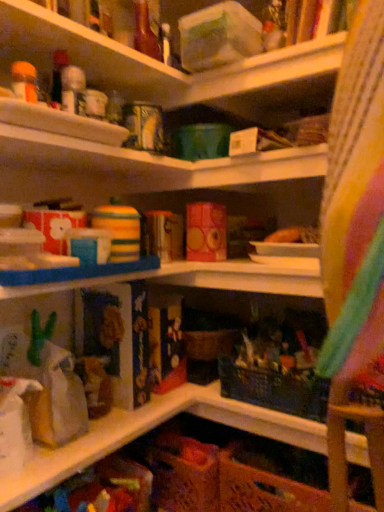
Question: Do you think orange woven basket at lower center is within brown paper bag at lower left, or outside of it?

Choices:
 (A) outside
 (B) inside

Answer: (A)

Question: Based on their positions, is orange woven basket at lower center located to the left or right of brown paper bag at lower left?

Choices:
 (A) right
 (B) left

Answer: (A)

Question: Is orange woven basket at lower center wider or thinner than brown paper bag at lower left?

Choices:
 (A) wide
 (B) thin

Answer: (A)

Question: Relative to orange woven basket at lower center, is brown paper bag at lower left in front or behind?

Choices:
 (A) behind
 (B) front

Answer: (B)

Question: Considering the positions of point (205, 411) and point (264, 456), is point (205, 411) closer or farther from the camera than point (264, 456)?

Choices:
 (A) closer
 (B) farther

Answer: (A)

Question: From the image's perspective, is brown paper bag at lower left located above or below orange woven basket at lower center?

Choices:
 (A) below
 (B) above

Answer: (B)

Question: Is brown paper bag at lower left wider or thinner than orange woven basket at lower center?

Choices:
 (A) thin
 (B) wide

Answer: (A)